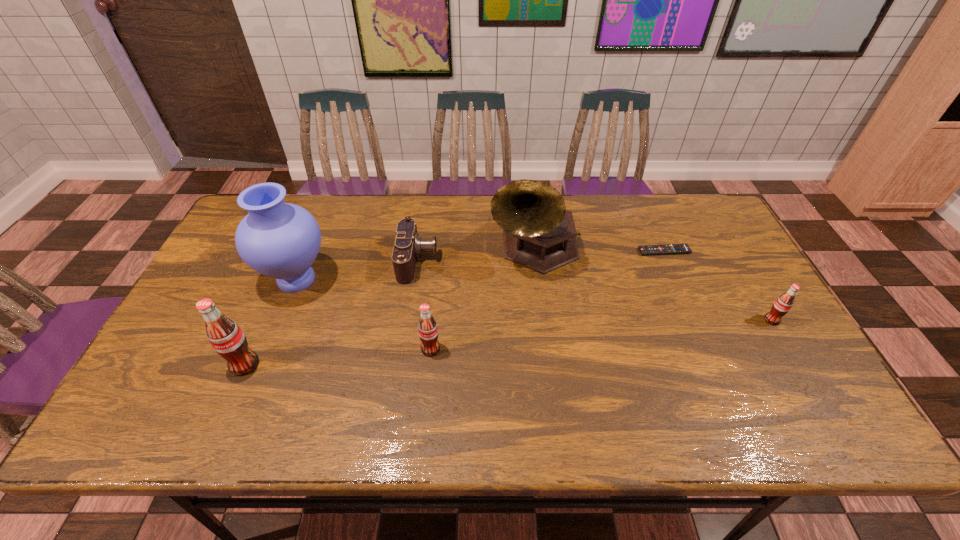
Where is `empty location between the remote control and the second soda from right to left`? Image resolution: width=960 pixels, height=540 pixels. empty location between the remote control and the second soda from right to left is located at coordinates (547, 300).

The width and height of the screenshot is (960, 540). Identify the location of free space between the phonograph record and the remote control. (x=599, y=249).

You are a GUI agent. You are given a task and a screenshot of the screen. Output one action in this format:
    pyautogui.click(x=<x>, y=<y>)
    Task: Click on the free spot between the phonograph record and the second shortest soda
    
    Given the screenshot: What is the action you would take?
    pyautogui.click(x=483, y=299)

Identify the location of empty space that is in between the camera and the shortest soda. [595, 291].

The image size is (960, 540). What are the coordinates of `free space between the shortest object and the third shortest object` in the screenshot? It's located at (x=718, y=286).

Image resolution: width=960 pixels, height=540 pixels. In order to click on free space between the leftmost soda and the third shortest object in this screenshot , I will do `click(509, 342)`.

Find the location of `blank region between the rightmost soda and the vase`. blank region between the rightmost soda and the vase is located at coordinates (534, 300).

Find the location of a particular element. The width and height of the screenshot is (960, 540). free space between the phonograph record and the remote control is located at coordinates (599, 249).

Identify which object is the fourth closest to the second object from right to left. Please provide its 2D coordinates. Your answer should be formatted as a tuple, i.e. [(x, y)], where the tuple contains the x and y coordinates of a point satisfying the conditions above.

[(428, 333)]

Locate which object ranks sixth in proximity to the shortest soda. Please provide its 2D coordinates. Your answer should be formatted as a tuple, i.e. [(x, y)], where the tuple contains the x and y coordinates of a point satisfying the conditions above.

[(225, 336)]